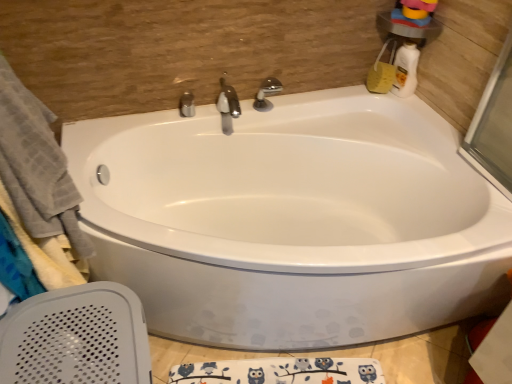
Question: Would you say white glossy bottle at upper right is to the left or to the right of polished chrome faucet at center, acting as the third tap starting from the right, in the picture?

Choices:
 (A) right
 (B) left

Answer: (A)

Question: Considering the positions of white glossy bottle at upper right and polished chrome faucet at center, the 1th tap positioned from the left, in the image, is white glossy bottle at upper right wider or thinner than polished chrome faucet at center, the 1th tap positioned from the left,?

Choices:
 (A) thin
 (B) wide

Answer: (B)

Question: Considering the real-world distances, which object is closest to the polished chrome faucet at upper center, which is the 3th tap from left to right?

Choices:
 (A) satin nickel faucet at center, positioned as the second tap in right-to-left order
 (B) polished chrome faucet at center, the 1th tap positioned from the left
 (C) white glossy bottle at upper right
 (D) white glossy bathtub at center
 (E) gray cotton towel at left

Answer: (A)

Question: Which object is positioned closest to the polished chrome faucet at upper center, acting as the 1th tap starting from the right?

Choices:
 (A) white glossy bottle at upper right
 (B) gray cotton towel at left
 (C) polished chrome faucet at center, the 1th tap positioned from the left
 (D) satin nickel faucet at center, the second tap in the left-to-right sequence
 (E) white glossy bathtub at center

Answer: (D)